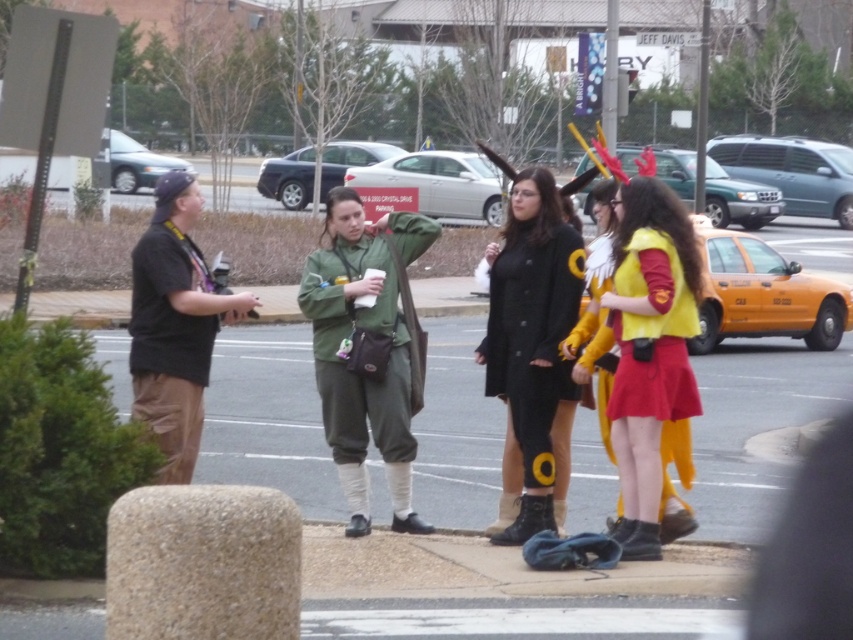
Looking at this image, between green matte jacket at center and black matte coat at center, which one appears on the right side from the viewer's perspective?

black matte coat at center is more to the right.

Between green matte jacket at center and black matte coat at center, which one appears on the left side from the viewer's perspective?

From the viewer's perspective, green matte jacket at center appears more on the left side.

Is point (350, 232) farther from camera compared to point (556, 298)?

Yes, point (350, 232) is farther from viewer.

This screenshot has height=640, width=853. What are the coordinates of `green matte jacket at center` in the screenshot? It's located at (364, 348).

Is smooth asphalt pavement at center to the right of black cotton shirt at left from the viewer's perspective?

Yes, smooth asphalt pavement at center is to the right of black cotton shirt at left.

The image size is (853, 640). What do you see at coordinates (756, 424) in the screenshot? I see `smooth asphalt pavement at center` at bounding box center [756, 424].

Locate an element on the screen. smooth asphalt pavement at center is located at coordinates (756, 424).

Is green matte jacket at center closer to camera compared to black cotton shirt at left?

No, it is not.

Does point (335, 417) come farther from viewer compared to point (164, 268)?

Yes, point (335, 417) is behind point (164, 268).

You are a GUI agent. You are given a task and a screenshot of the screen. Output one action in this format:
    pyautogui.click(x=<x>, y=<y>)
    Task: Click on the green matte jacket at center
    This screenshot has width=853, height=640.
    Given the screenshot: What is the action you would take?
    pyautogui.click(x=364, y=348)